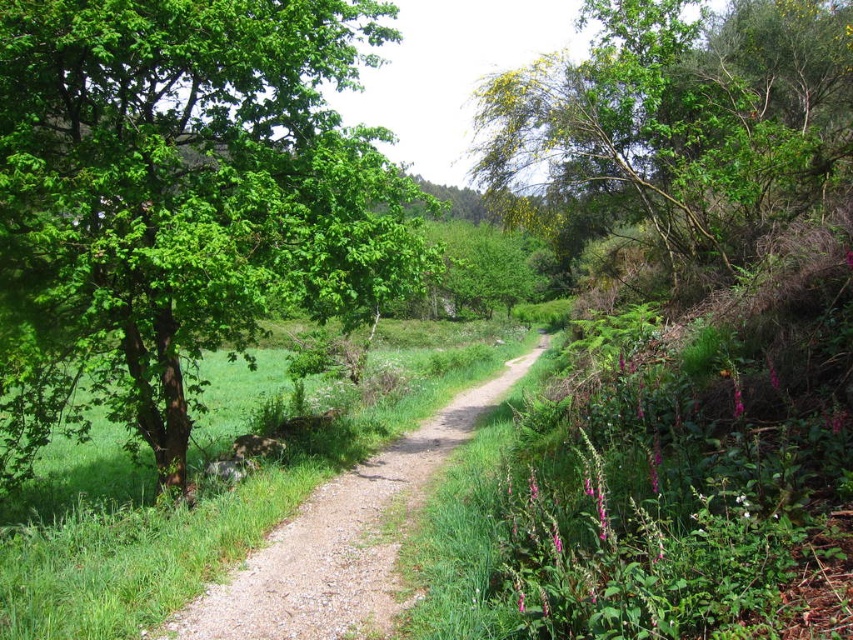
Which of these two, green leafy tree at left or dirt path at center, stands shorter?

Standing shorter between the two is dirt path at center.

What do you see at coordinates (178, 196) in the screenshot? Image resolution: width=853 pixels, height=640 pixels. I see `green leafy tree at left` at bounding box center [178, 196].

The width and height of the screenshot is (853, 640). Identify the location of green leafy tree at left. (178, 196).

Describe the element at coordinates (178, 196) in the screenshot. This screenshot has height=640, width=853. I see `green leafy tree at left` at that location.

The width and height of the screenshot is (853, 640). Find the location of `green leafy tree at left`. green leafy tree at left is located at coordinates (178, 196).

Is green leafy tree at upper right below dirt path at center?

No, green leafy tree at upper right is not below dirt path at center.

At what (x,y) coordinates should I click in order to perform the action: click on green leafy tree at upper right. Please return your answer as a coordinate pair (x, y). The width and height of the screenshot is (853, 640). Looking at the image, I should click on (672, 124).